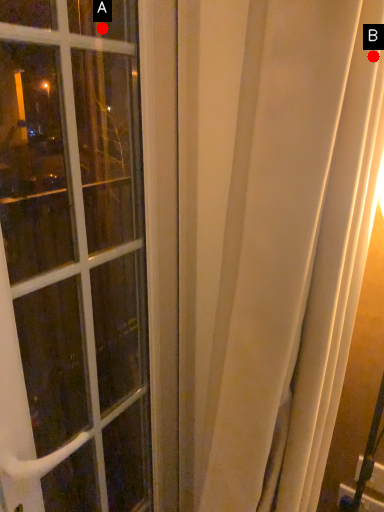
Question: Two points are circled on the image, labeled by A and B beside each circle. Which of the following is the farthest from the observer?

Choices:
 (A) A is further
 (B) B is further

Answer: (A)